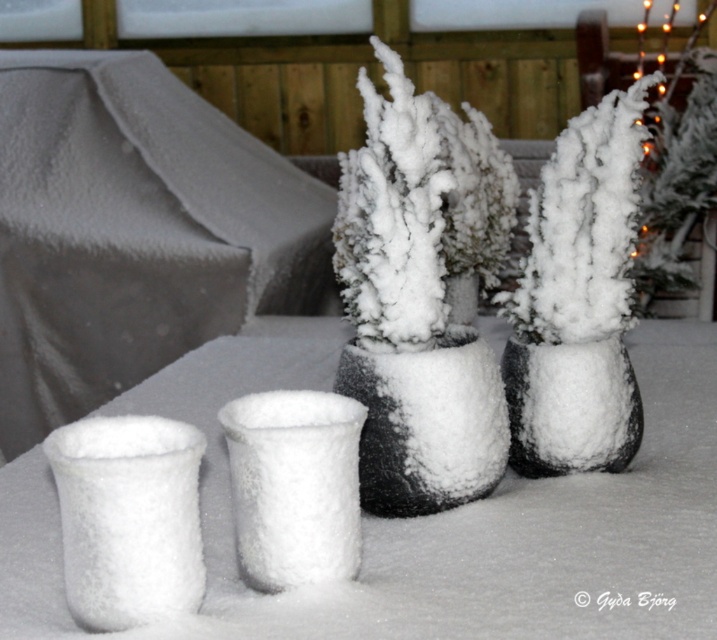
Question: From the image, what is the correct spatial relationship of snow-covered plant at center in relation to black matte vase at center?

Choices:
 (A) below
 (B) above

Answer: (B)

Question: Which of these objects is positioned farthest from the black matte vase at center?

Choices:
 (A) white fluffy vase at center
 (B) snow-covered plant at center

Answer: (A)

Question: Which of these objects is positioned farthest from the snow-covered plant at center?

Choices:
 (A) frosted ceramic vase at center
 (B) white fluffy vase at center

Answer: (B)

Question: Where is white fluffy vase at lower left located in relation to frosted ceramic vase at center in the image?

Choices:
 (A) right
 (B) left

Answer: (B)

Question: Among these points, which one is farthest from the camera?

Choices:
 (A) (338, 528)
 (B) (386, 204)
 (C) (402, 500)
 (D) (632, 428)

Answer: (D)

Question: Is white frosted plant at center above frosted ceramic vase at center?

Choices:
 (A) no
 (B) yes

Answer: (B)